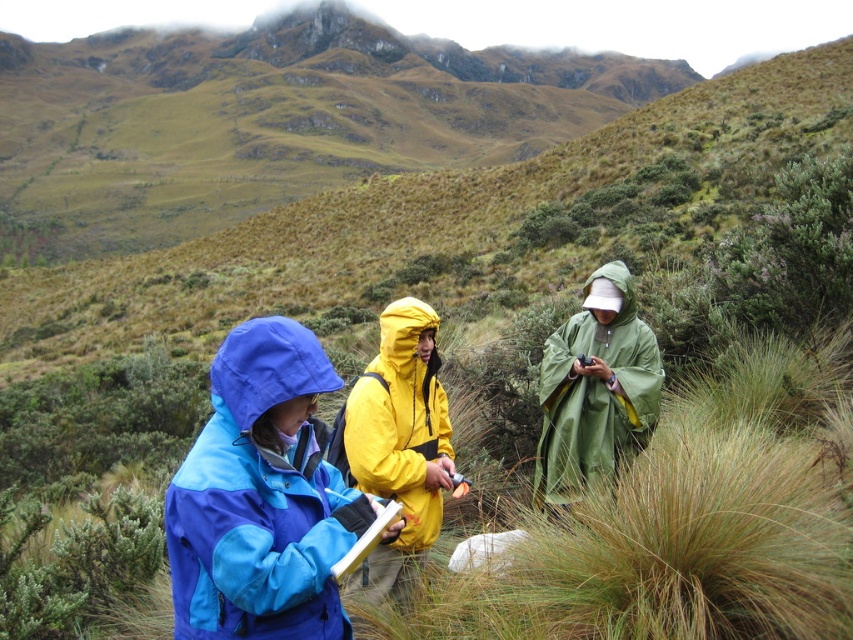
Question: Does brown grassy hillside at upper center have a lesser width compared to blue waterproof jacket at left?

Choices:
 (A) no
 (B) yes

Answer: (A)

Question: Is brown grassy hillside at upper center closer to camera compared to yellow matte jacket at center?

Choices:
 (A) yes
 (B) no

Answer: (B)

Question: Among these objects, which one is farthest from the camera?

Choices:
 (A) yellow matte jacket at center
 (B) brown dry grass at center

Answer: (A)

Question: Among these points, which one is nearest to the camera?

Choices:
 (A) (399, 385)
 (B) (212, 579)
 (C) (413, 156)

Answer: (B)

Question: Which point is farther to the camera?

Choices:
 (A) blue waterproof jacket at left
 (B) brown dry grass at center

Answer: (B)

Question: Is brown grassy hillside at upper center wider than brown dry grass at center?

Choices:
 (A) yes
 (B) no

Answer: (A)